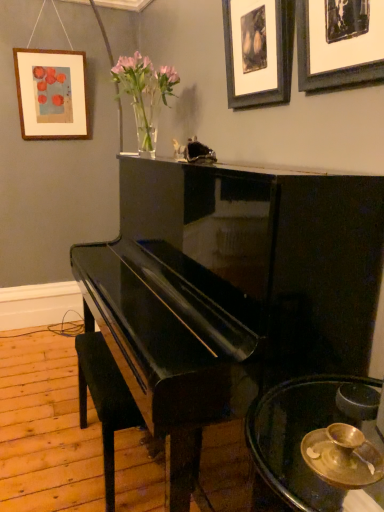
Find the location of a particular element. This screenshot has height=512, width=384. free point behind gold metallic bowl at lower right is located at coordinates (292, 409).